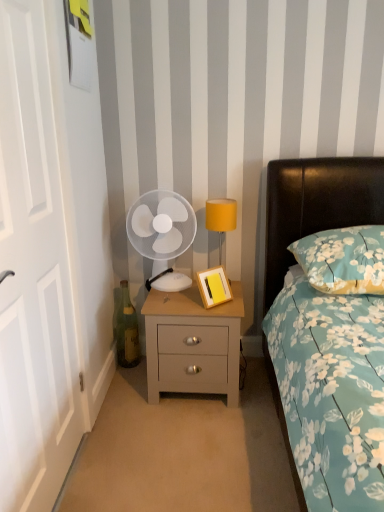
I want to click on free space in front of light wood/texture nightstand at center, so click(x=195, y=436).